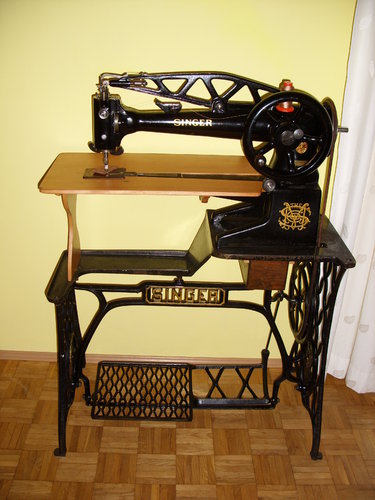
This screenshot has width=375, height=500. Identify the location of wood floor. (170, 459).